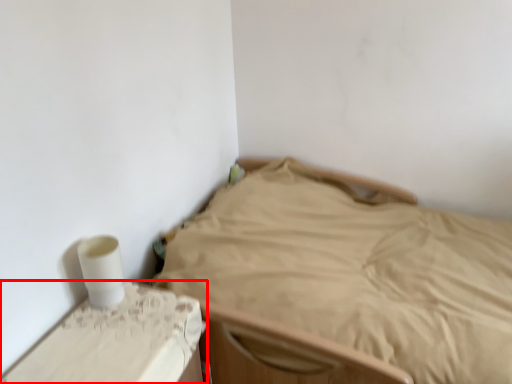
Question: From the image's perspective, considering the relative positions of furniture (annotated by the red box) and bed in the image provided, where is furniture (annotated by the red box) located with respect to the staircase?

Choices:
 (A) above
 (B) below

Answer: (B)